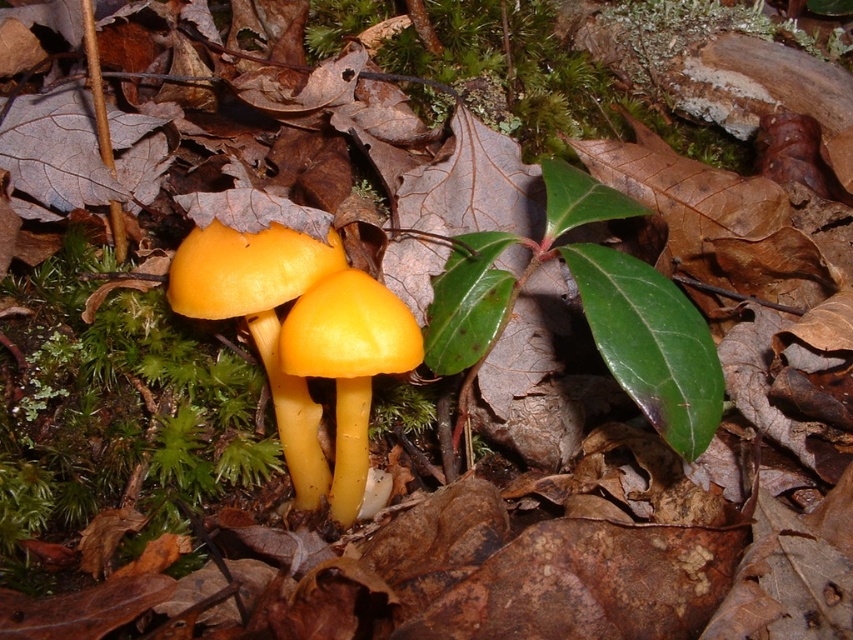
You are a mycologist examining the yellow smooth mushrooms at center and the yellow smooth mushroom at center in the forest floor scene. Which of these two mushrooms is larger?

The yellow smooth mushrooms at center is bigger than the yellow smooth mushroom at center.

You are a botanist examining the forest floor. You notice a point marked at coordinates (262, 321). What significant feature is located at this point?

The point at coordinates (262, 321) marks the location of the yellow smooth mushrooms at center.